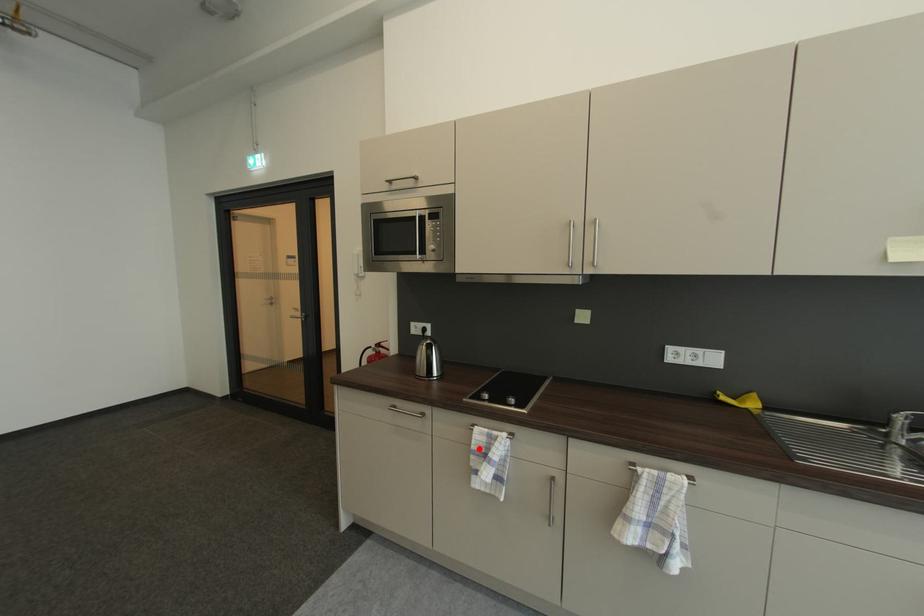
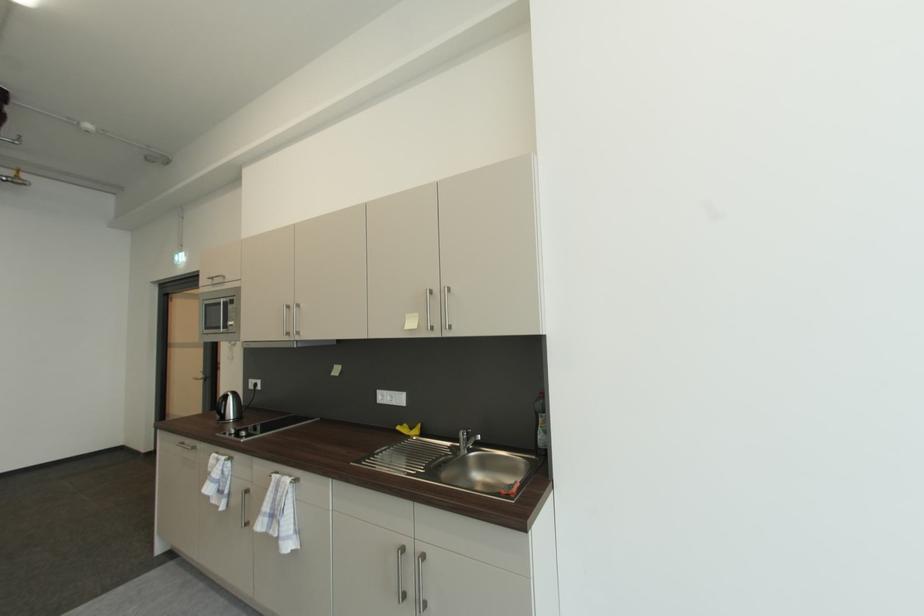
Where in the second image is the point corresponding to the highlighted location from the first image?

(215, 471)